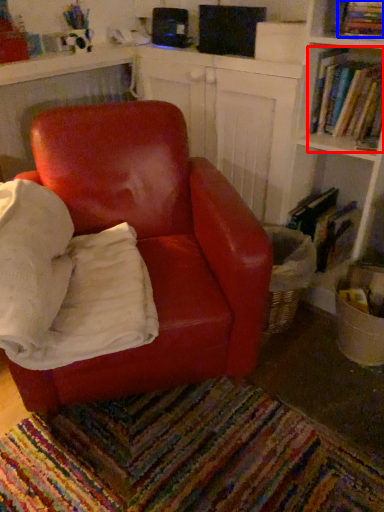
Question: Among these objects, which one is nearest to the camera, book (highlighted by a red box) or book (highlighted by a blue box)?

Choices:
 (A) book
 (B) book

Answer: (B)